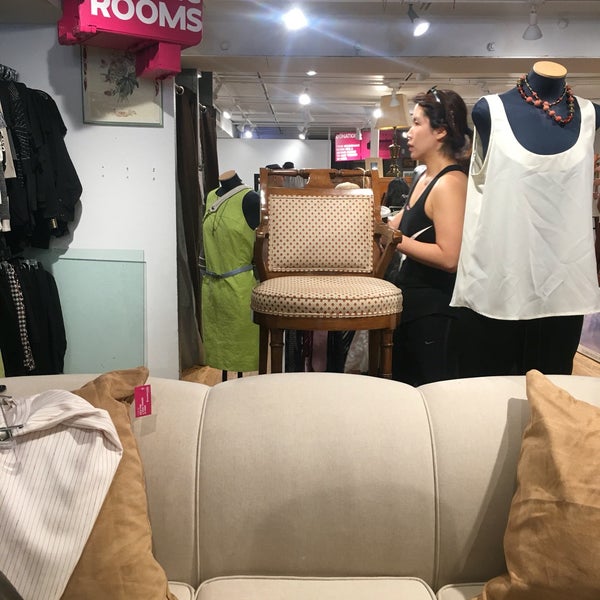
The width and height of the screenshot is (600, 600). In order to click on light in this screenshot , I will do [294, 21].